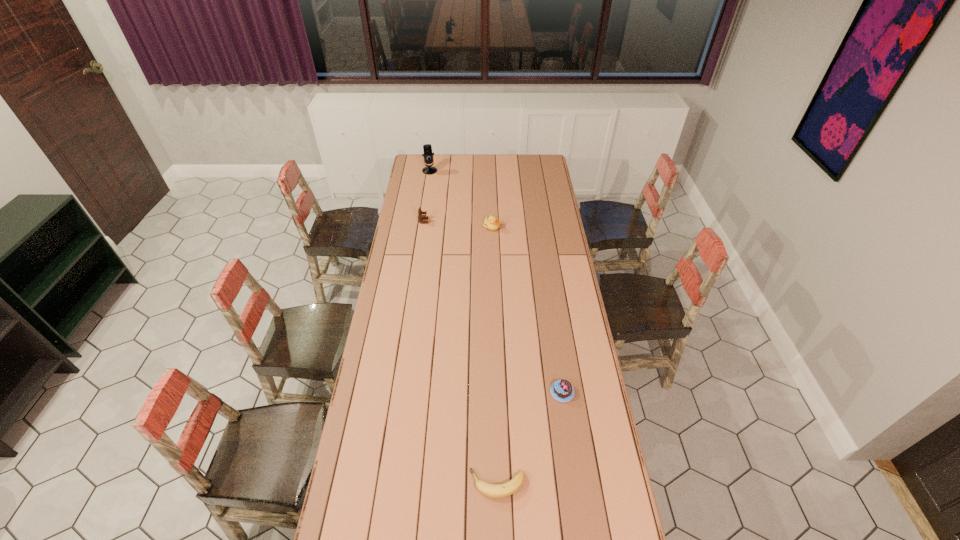
Locate an element on the screen. free space located on the front-facing side of the duckling is located at coordinates (492, 243).

Where is `free space located on the back of the chocolate cake`? The height and width of the screenshot is (540, 960). free space located on the back of the chocolate cake is located at coordinates (552, 323).

You are a GUI agent. You are given a task and a screenshot of the screen. Output one action in this format:
    pyautogui.click(x=<x>, y=<y>)
    Task: Click on the vacant space located 0.370m at the stem of the banana
    This screenshot has height=540, width=960.
    Given the screenshot: What is the action you would take?
    pyautogui.click(x=353, y=484)

You are a GUI agent. You are given a task and a screenshot of the screen. Output one action in this format:
    pyautogui.click(x=<x>, y=<y>)
    Task: Click on the blank space located 0.270m at the stem of the banana
    
    Given the screenshot: What is the action you would take?
    pyautogui.click(x=385, y=484)

Identify the location of vacant area situated 0.280m at the stem of the banana. The height and width of the screenshot is (540, 960). (382, 484).

This screenshot has height=540, width=960. What are the coordinates of `object that is at the far edge` in the screenshot? It's located at (427, 148).

I want to click on microphone present at the left edge, so click(427, 148).

The height and width of the screenshot is (540, 960). In order to click on teddy bear at the left edge in this screenshot , I will do pos(420,217).

Identify the location of object that is at the right edge. This screenshot has width=960, height=540. (562, 390).

Where is `object positioned at the far left corner`? This screenshot has height=540, width=960. object positioned at the far left corner is located at coordinates (427, 148).